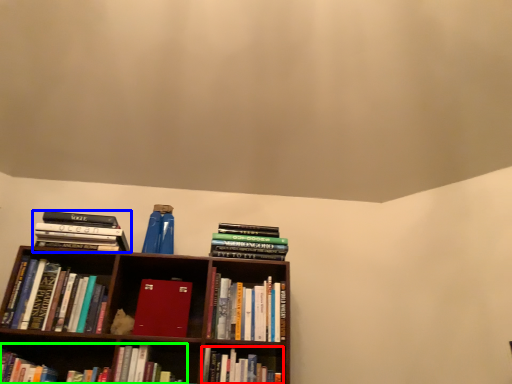
Question: Based on their relative distances, which object is nearer to book (highlighted by a red box)? Choose from book (highlighted by a blue box) and book (highlighted by a green box).

Choices:
 (A) book
 (B) book

Answer: (B)